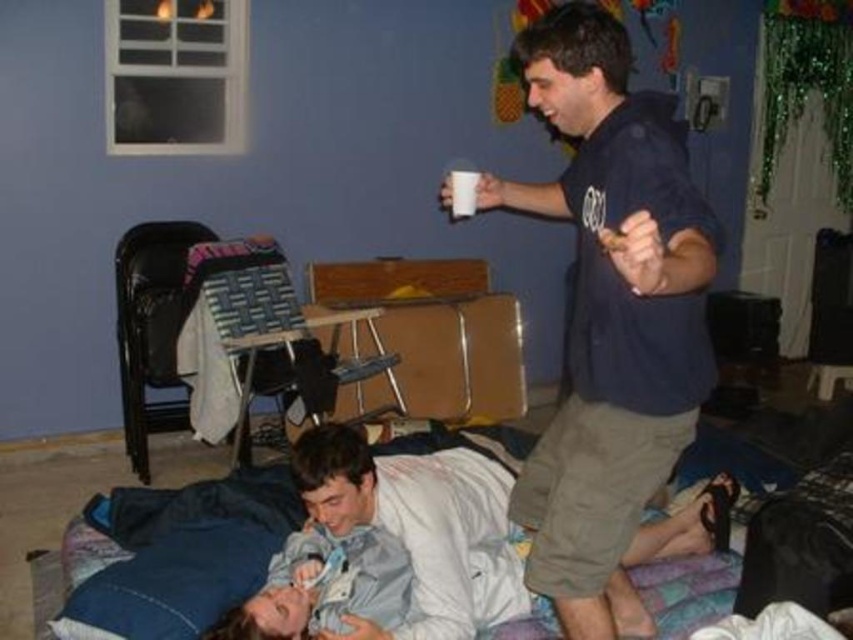
Question: Does dark blue shirt at upper right have a smaller size compared to denim fabric bed at lower center?

Choices:
 (A) no
 (B) yes

Answer: (A)

Question: Observing the image, what is the correct spatial positioning of dark blue shirt at upper right in reference to denim fabric bed at lower center?

Choices:
 (A) left
 (B) right

Answer: (B)

Question: Does dark blue shirt at upper right have a lesser width compared to denim fabric bed at lower center?

Choices:
 (A) no
 (B) yes

Answer: (B)